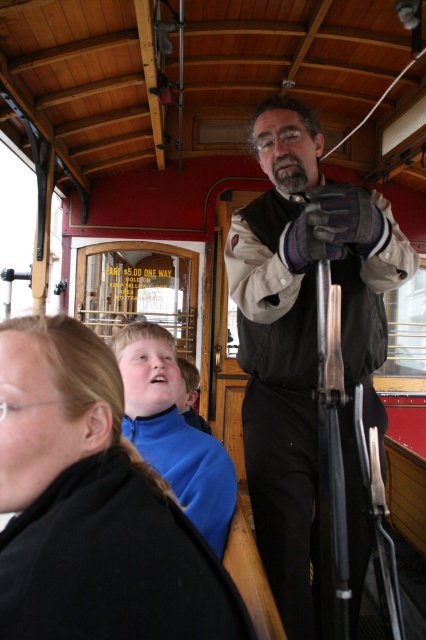
Question: Is the position of black fabric jacket at lower left more distant than that of matte black vest at center?

Choices:
 (A) yes
 (B) no

Answer: (B)

Question: Which of the following is the farthest from the observer?

Choices:
 (A) black fabric jacket at lower left
 (B) matte black vest at center

Answer: (B)

Question: Which point is farther from the camera taking this photo?

Choices:
 (A) (368, 536)
 (B) (46, 621)

Answer: (A)

Question: Does black fabric jacket at lower left come behind matte black vest at center?

Choices:
 (A) yes
 (B) no

Answer: (B)

Question: Does black fabric jacket at lower left have a lesser width compared to matte black vest at center?

Choices:
 (A) yes
 (B) no

Answer: (A)